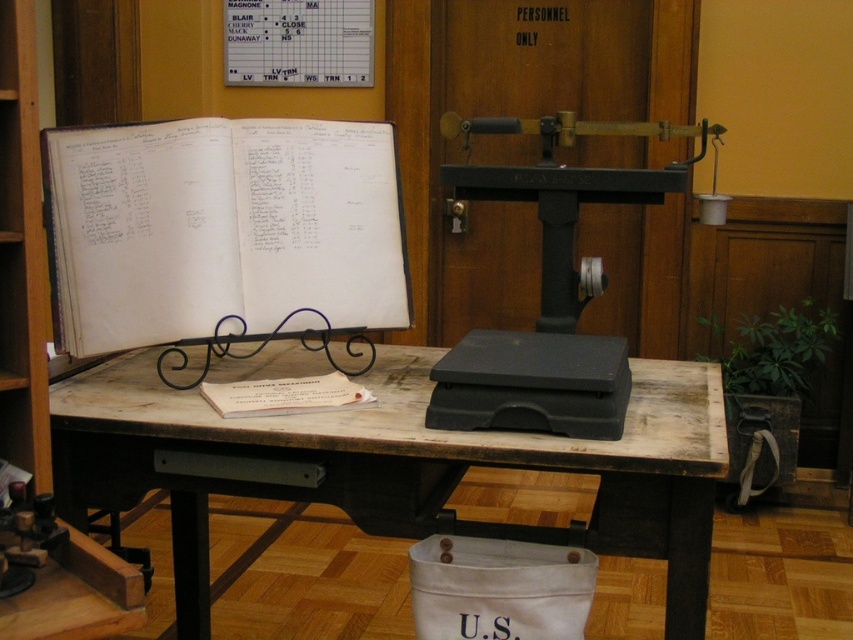
Question: Which point is closer to the camera?

Choices:
 (A) (636, 376)
 (B) (248, 301)
 (C) (300, 406)
 (D) (25, 422)

Answer: (D)

Question: Does wooden table at center appear under white paper at center?

Choices:
 (A) yes
 (B) no

Answer: (A)

Question: Is wooden bookshelf at left closer to the viewer compared to white paper at center?

Choices:
 (A) yes
 (B) no

Answer: (A)

Question: Which is farther from the white paper at center?

Choices:
 (A) wooden table at center
 (B) white paper book at center

Answer: (B)

Question: In this image, where is wooden table at center located relative to wooden bookshelf at left?

Choices:
 (A) left
 (B) right

Answer: (B)

Question: Which object appears farthest from the camera in this image?

Choices:
 (A) white paper at center
 (B) white paper book at center
 (C) wooden table at center
 (D) wooden bookshelf at left

Answer: (B)